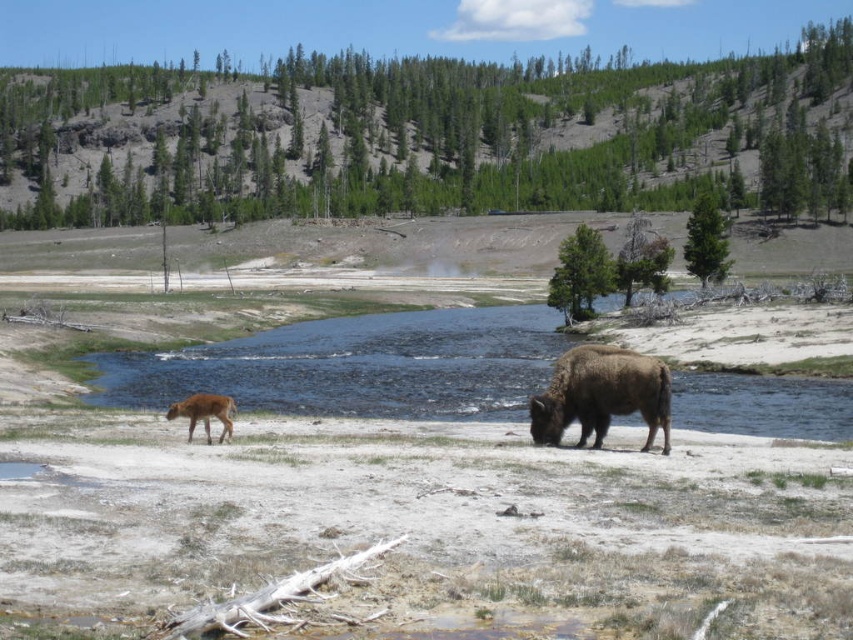
Does point (648, 387) come behind point (231, 433)?

No, it is not.

Which is behind, point (575, 394) or point (224, 416)?

The point (575, 394) is behind.

The image size is (853, 640). I want to click on brown furry yak at lower right, so click(601, 394).